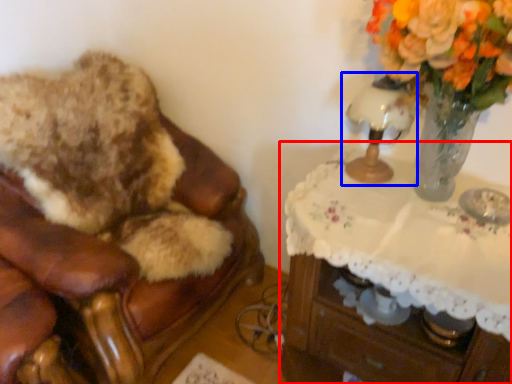
Question: Which of the following is the closest to the observer, table (highlighted by a red box) or table lamp (highlighted by a blue box)?

Choices:
 (A) table
 (B) table lamp

Answer: (A)